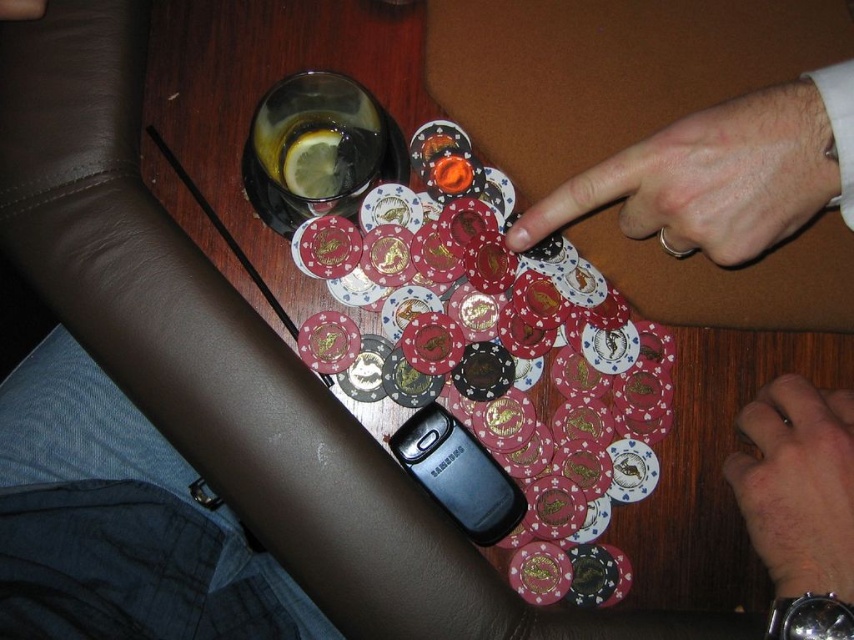
You are a poker player observing the game. You notice the smooth skin finger at upper right and the smooth skin hand at lower right on the table. Which object has a greater width?

The smooth skin finger at upper right has a greater width than the smooth skin hand at lower right according to the description.

You are a player at the poker table and want to place your metallic blue phone at center on the table without disturbing the chips. Where should you place it?

You should place the metallic blue phone at center at the coordinates point (120,524) to ensure it doesn not disturb the chips.

You are a player at the poker table and see the smooth skin finger at upper right and the smooth skin hand at lower right. Which body part is closer to your left side?

The smooth skin finger at upper right is closer to your left side because it is positioned on the left side of the smooth skin hand at lower right.